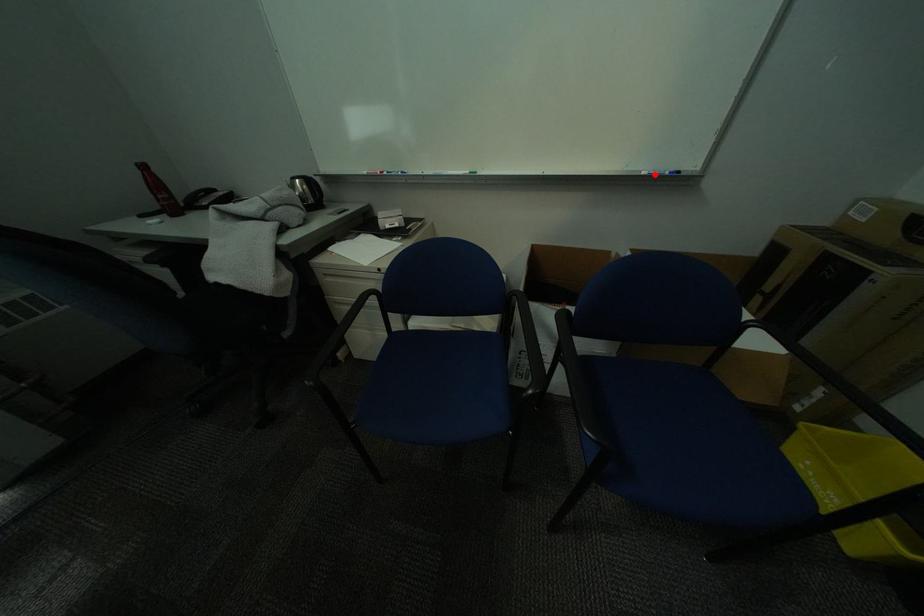
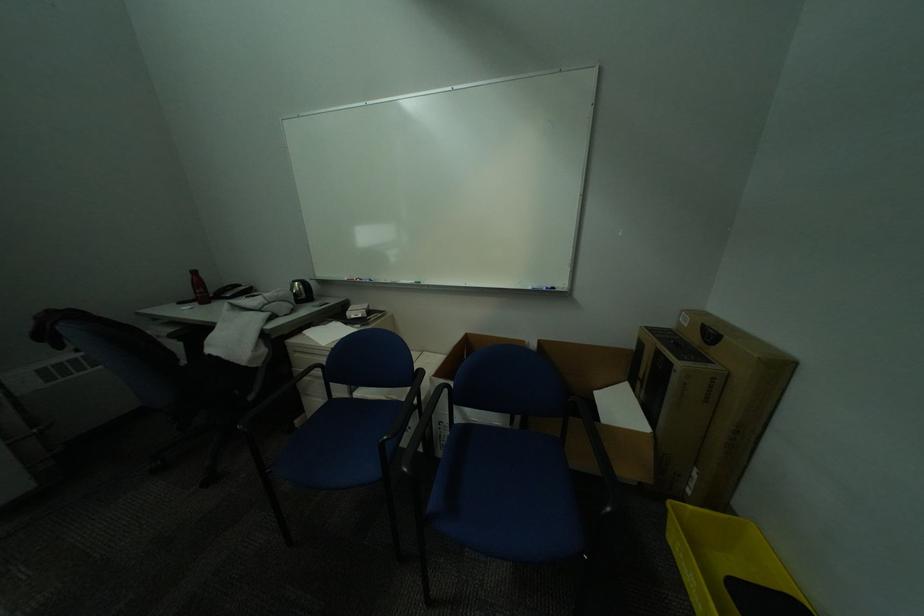
Find the pixel in the second image that matches the highlighted location in the first image.

(541, 289)